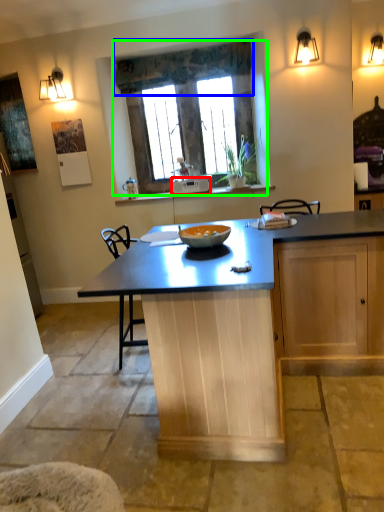
Question: Which is farther away from appliance (highlighted by a red box)? curtain (highlighted by a blue box) or window (highlighted by a green box)?

Choices:
 (A) curtain
 (B) window

Answer: (A)